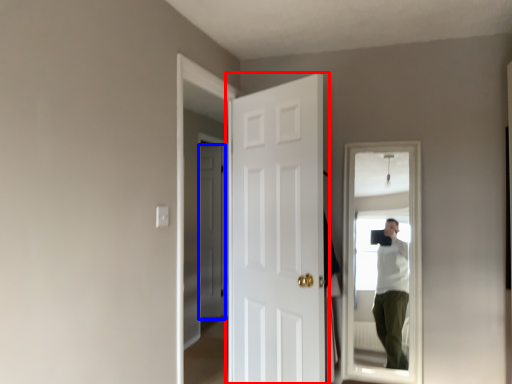
Question: Which object appears farthest to the camera in this image, door (highlighted by a red box) or door (highlighted by a blue box)?

Choices:
 (A) door
 (B) door

Answer: (B)